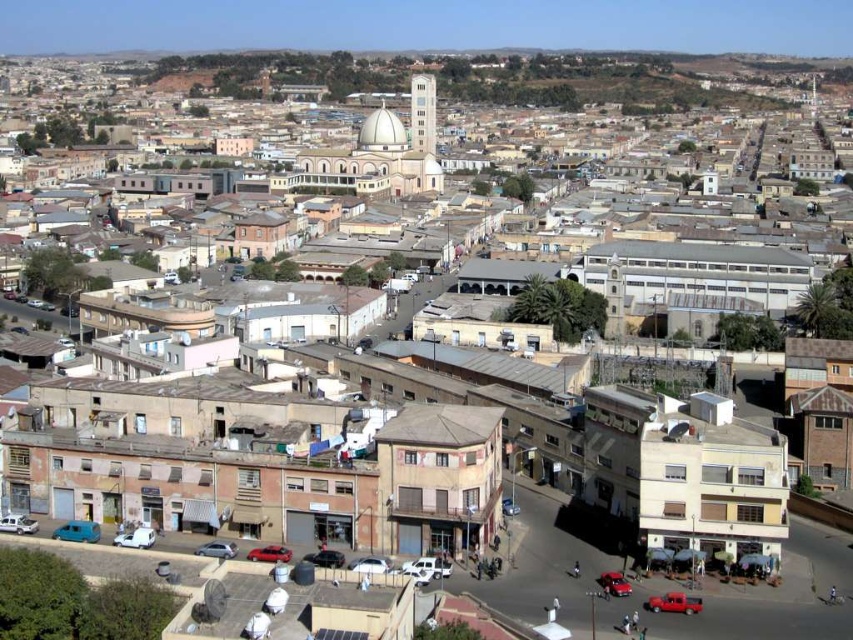
Is metallic red car at center closer to camera compared to shiny red car at center?

No, it is not.

Does metallic red car at center appear over shiny red car at center?

Indeed, metallic red car at center is positioned over shiny red car at center.

Which is in front, point (259, 552) or point (604, 579)?

Positioned in front is point (604, 579).

At what (x,y) coordinates should I click in order to perform the action: click on metallic red car at center. Please return your answer as a coordinate pair (x, y). Looking at the image, I should click on (270, 554).

Is white matte car at lower left further to camera compared to matte black car at center?

That is True.

Who is more forward, (30, 525) or (323, 550)?

Positioned in front is point (323, 550).

Describe the element at coordinates (16, 524) in the screenshot. This screenshot has width=853, height=640. I see `white matte car at lower left` at that location.

This screenshot has height=640, width=853. I want to click on white matte car at lower left, so click(16, 524).

Which of these two, shiny red car at center or silver metallic car at center, stands taller?

With more height is silver metallic car at center.

Between point (614, 580) and point (204, 548), which one is positioned behind?

Positioned behind is point (204, 548).

The height and width of the screenshot is (640, 853). Find the location of `shiny red car at center`. shiny red car at center is located at coordinates (614, 582).